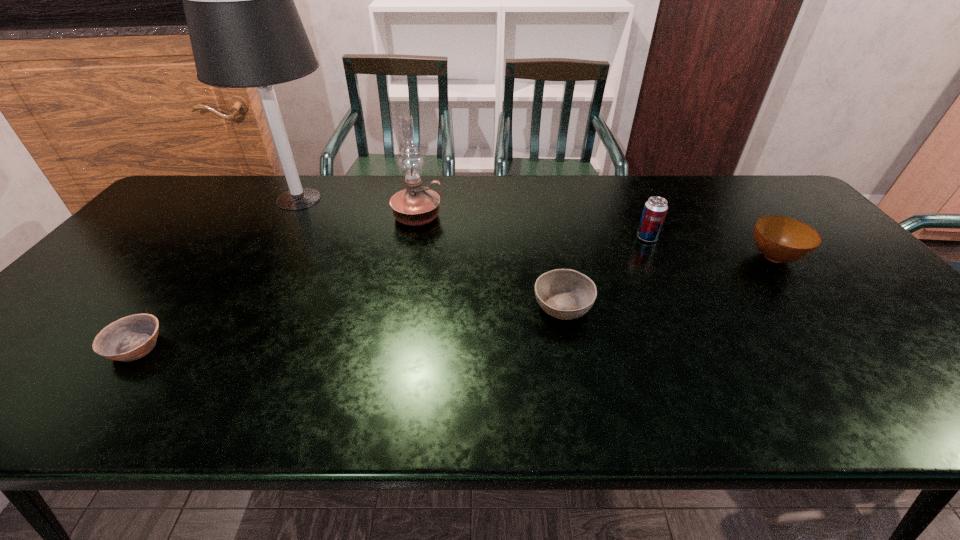
The height and width of the screenshot is (540, 960). In order to click on the shortest bowl in this screenshot , I will do `click(132, 337)`.

Find the location of a particular element. The width and height of the screenshot is (960, 540). vacant space located on the left of the table lamp is located at coordinates (219, 199).

This screenshot has height=540, width=960. I want to click on free space located on the left of the third object from left to right, so click(306, 217).

Identify the location of vacant space located on the front of the third tallest object. (657, 256).

This screenshot has height=540, width=960. What are the coordinates of `free region located on the back of the tallest bowl` in the screenshot? It's located at coord(727,198).

The image size is (960, 540). I want to click on vacant point located 0.050m on the left of the second tallest bowl, so click(x=513, y=306).

Locate an element on the screen. vacant space situated 0.080m on the right of the shortest object is located at coordinates (199, 346).

This screenshot has width=960, height=540. In order to click on table lamp located at the far edge in this screenshot , I will do `click(245, 30)`.

Image resolution: width=960 pixels, height=540 pixels. What are the coordinates of `oil lamp that is at the far edge` in the screenshot? It's located at (416, 205).

Where is `object that is at the right edge`? The image size is (960, 540). object that is at the right edge is located at coordinates (780, 239).